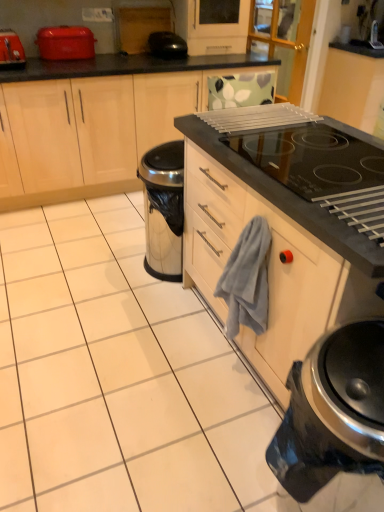
Question: Considering the relative positions of matte red toaster at upper left, the second kitchen appliance positioned from the right, and matte wood cabinets at left in the image provided, is matte red toaster at upper left, the second kitchen appliance positioned from the right, to the left of matte wood cabinets at left from the viewer's perspective?

Choices:
 (A) yes
 (B) no

Answer: (A)

Question: Is the position of matte red toaster at upper left, which is the 1th kitchen appliance in top-to-bottom order, more distant than that of matte wood cabinets at left?

Choices:
 (A) no
 (B) yes

Answer: (B)

Question: Is matte red toaster at upper left, acting as the 2th kitchen appliance starting from the left, oriented towards matte wood cabinets at left?

Choices:
 (A) no
 (B) yes

Answer: (A)

Question: Considering the relative sizes of matte red toaster at upper left, which is the 3th kitchen appliance from front to back, and matte wood cabinets at left in the image provided, is matte red toaster at upper left, which is the 3th kitchen appliance from front to back, bigger than matte wood cabinets at left?

Choices:
 (A) no
 (B) yes

Answer: (A)

Question: Is matte red toaster at upper left, which is the 1th kitchen appliance in top-to-bottom order, smaller than matte wood cabinets at left?

Choices:
 (A) yes
 (B) no

Answer: (A)

Question: Can you confirm if matte red toaster at upper left, which ranks as the first kitchen appliance in back-to-front order, is thinner than matte wood cabinets at left?

Choices:
 (A) no
 (B) yes

Answer: (B)

Question: Is black glass oven at upper right thinner than gray cotton hand towel at center?

Choices:
 (A) yes
 (B) no

Answer: (B)

Question: Is black glass oven at upper right taller than gray cotton hand towel at center?

Choices:
 (A) yes
 (B) no

Answer: (A)

Question: Is black glass oven at upper right smaller than gray cotton hand towel at center?

Choices:
 (A) no
 (B) yes

Answer: (A)

Question: Is black glass oven at upper right positioned beyond the bounds of gray cotton hand towel at center?

Choices:
 (A) yes
 (B) no

Answer: (A)

Question: Is black glass oven at upper right in contact with gray cotton hand towel at center?

Choices:
 (A) no
 (B) yes

Answer: (A)

Question: Is black glass oven at upper right positioned with its back to gray cotton hand towel at center?

Choices:
 (A) no
 (B) yes

Answer: (A)

Question: Does black glossy toaster at upper center turn towards black glass oven at upper right?

Choices:
 (A) yes
 (B) no

Answer: (A)